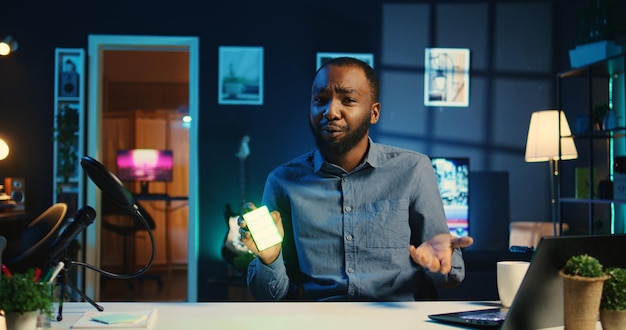
The image size is (626, 330). Find the location of `empty desktop`. empty desktop is located at coordinates (340, 313).